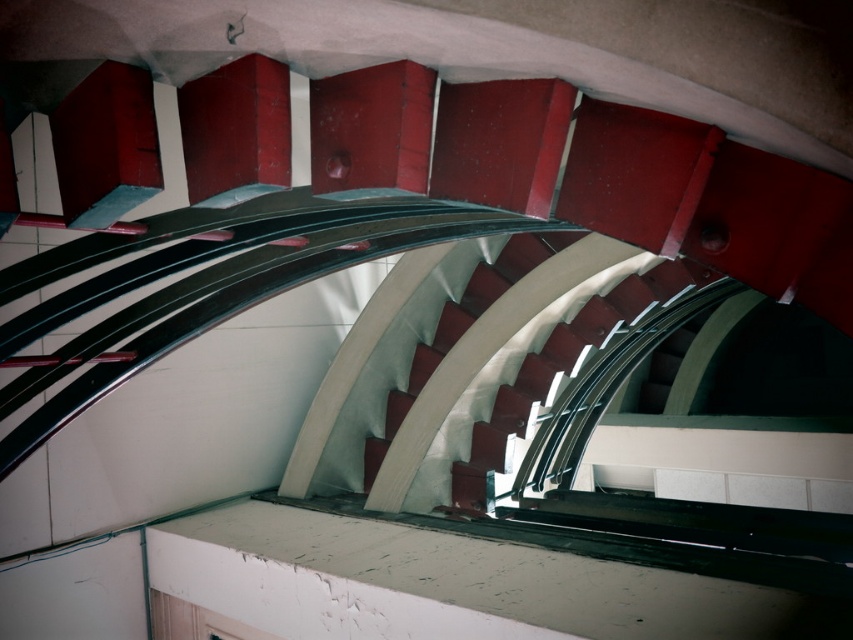
You are standing in front of the architectural structure and want to touch the first stair you can reach. Which stair would you touch first, the smooth white stair at center or the white glossy stair at center?

The smooth white stair at center is closer to the viewer than the white glossy stair at center, so you would touch the smooth white stair at center first.

You are standing in the building and see the point marked at coordinates [561,368]. According to the image, where exactly is this point located?

The point is located on the smooth white stair at center.